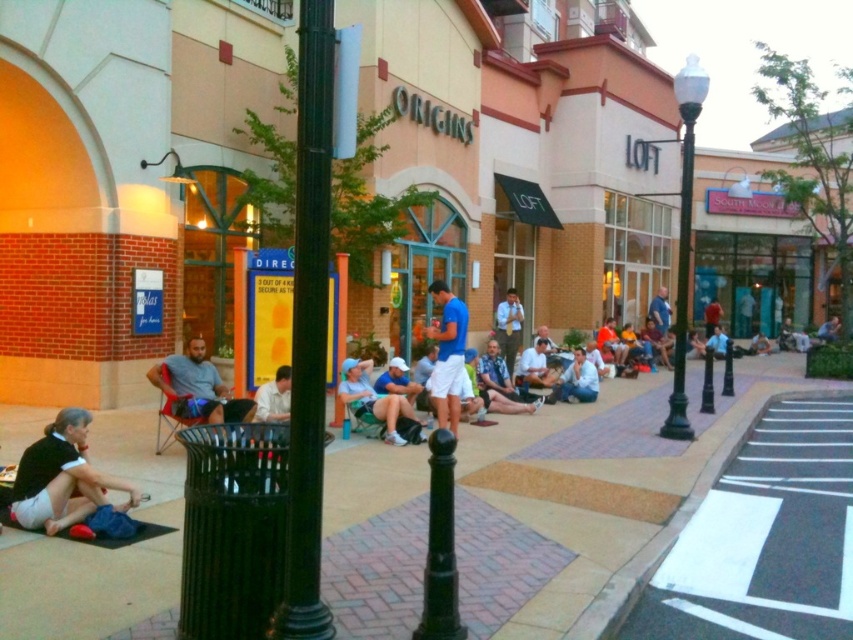
Can you confirm if matte black shirt at lower left is positioned to the left of light blue shirt at center?

Indeed, matte black shirt at lower left is positioned on the left side of light blue shirt at center.

Does matte black shirt at lower left appear on the right side of light blue shirt at center?

No, matte black shirt at lower left is not to the right of light blue shirt at center.

Is point (39, 451) farther from viewer compared to point (509, 362)?

That is False.

You are a GUI agent. You are given a task and a screenshot of the screen. Output one action in this format:
    pyautogui.click(x=<x>, y=<y>)
    Task: Click on the matte black shirt at lower left
    This screenshot has height=640, width=853.
    Given the screenshot: What is the action you would take?
    (62, 477)

Who is positioned more to the left, matte brick mall at center or light blue shirt at center?

Positioned to the left is light blue shirt at center.

Can you confirm if matte brick mall at center is positioned above light blue shirt at center?

Yes.

Does point (764, 320) come in front of point (495, 314)?

That is False.

What are the coordinates of `matte brick mall at center` in the screenshot? It's located at (519, 160).

Is point (769, 408) more distant than point (161, 365)?

Yes, point (769, 408) is behind point (161, 365).

Does white asphalt at lower right appear on the right side of gray fabric chair at lower left?

Indeed, white asphalt at lower right is positioned on the right side of gray fabric chair at lower left.

Is point (825, 600) positioned behind point (154, 365)?

No, (825, 600) is closer to viewer.

Find the location of a particular element. The height and width of the screenshot is (640, 853). white asphalt at lower right is located at coordinates (764, 538).